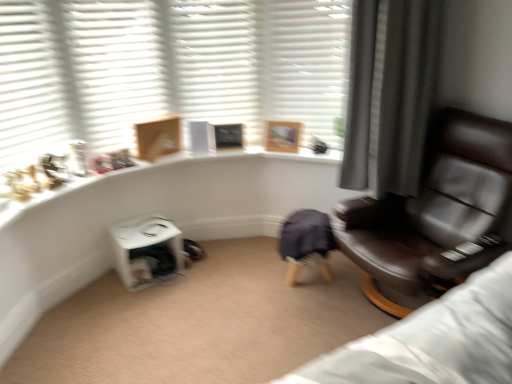
Describe the element at coordinates (29, 85) in the screenshot. This screenshot has width=512, height=384. I see `white matte shutters at upper left, positioned as the first shutter in left-to-right order` at that location.

Where is `white matte shutter at upper left, marked as the third shutter in a right-to-left arrangement`? This screenshot has width=512, height=384. white matte shutter at upper left, marked as the third shutter in a right-to-left arrangement is located at coordinates (114, 68).

Image resolution: width=512 pixels, height=384 pixels. I want to click on white matte shutters at upper left, the fourth shutter from the right, so click(29, 85).

Between white matte shutter at upper center, the second shutter from the right, and white matte shutter at upper left, the second shutter when ordered from left to right, which one has smaller width?

With smaller width is white matte shutter at upper center, the second shutter from the right.

Where is `shutter that is the 1st one when counting leftward from the white matte shutter at upper center, marked as the third shutter in a left-to-right arrangement`? Image resolution: width=512 pixels, height=384 pixels. shutter that is the 1st one when counting leftward from the white matte shutter at upper center, marked as the third shutter in a left-to-right arrangement is located at coordinates (114, 68).

Is white matte shutter at upper center, the second shutter from the right, turned away from white matte shutter at upper left, the second shutter when ordered from left to right?

No, white matte shutter at upper center, the second shutter from the right,'s orientation is not away from white matte shutter at upper left, the second shutter when ordered from left to right.

Would you say white matte shutter at upper center, the second shutter from the right, is outside white matte shutter at upper left, the second shutter when ordered from left to right?

Absolutely, white matte shutter at upper center, the second shutter from the right, is external to white matte shutter at upper left, the second shutter when ordered from left to right.

Would you consider white matte shutters at upper left, the fourth shutter from the right, to be distant from brown leather chair at right?

Yes, white matte shutters at upper left, the fourth shutter from the right, is far from brown leather chair at right.

Can you confirm if white matte shutters at upper left, positioned as the first shutter in left-to-right order, is positioned to the right of brown leather chair at right?

Incorrect, white matte shutters at upper left, positioned as the first shutter in left-to-right order, is not on the right side of brown leather chair at right.

How different are the orientations of white matte shutters at upper left, the fourth shutter from the right, and brown leather chair at right in degrees?

They differ by 119 degrees in their facing directions.

Between white matte shutters at upper left, the fourth shutter from the right, and brown leather chair at right, which one has smaller size?

white matte shutters at upper left, the fourth shutter from the right, is smaller.

Is brown leather chair at right aimed at white matte shutter at upper left, the second shutter when ordered from left to right?

No, brown leather chair at right is not facing towards white matte shutter at upper left, the second shutter when ordered from left to right.

Which object is closer to the camera taking this photo, brown leather chair at right or white matte shutter at upper left, marked as the third shutter in a right-to-left arrangement?

brown leather chair at right is closer to the camera.

Is brown leather chair at right far from white matte shutter at upper left, the second shutter when ordered from left to right?

brown leather chair at right is far away from white matte shutter at upper left, the second shutter when ordered from left to right.

Does brown leather chair at right have a greater height compared to white matte shutter at upper left, the second shutter when ordered from left to right?

Indeed, brown leather chair at right has a greater height compared to white matte shutter at upper left, the second shutter when ordered from left to right.

From the picture: Would you consider white matte shutter at upper center, arranged as the first shutter when viewed from the right, to be distant from white plastic table at lower center?

Yes, white matte shutter at upper center, arranged as the first shutter when viewed from the right, and white plastic table at lower center are quite far apart.

Is white matte shutter at upper center, arranged as the first shutter when viewed from the right, behind white plastic table at lower center?

No, white matte shutter at upper center, arranged as the first shutter when viewed from the right, is closer to the viewer.

What's the angular difference between white matte shutter at upper center, arranged as the first shutter when viewed from the right, and white plastic table at lower center's facing directions?

54.7 degrees.

Is white matte shutter at upper center, arranged as the first shutter when viewed from the right, to the left or to the right of white plastic table at lower center in the image?

Based on their positions, white matte shutter at upper center, arranged as the first shutter when viewed from the right, is located to the right of white plastic table at lower center.

Is white plastic table at lower center outside of wooden picture frame at upper center?

Yes, white plastic table at lower center is outside of wooden picture frame at upper center.

At what (x,y) coordinates should I click in order to perform the action: click on picture frame to the right of white plastic table at lower center. Please return your answer as a coordinate pair (x, y). The image size is (512, 384). Looking at the image, I should click on (282, 136).

Does white plastic table at lower center appear on the right side of wooden picture frame at upper center?

No, white plastic table at lower center is not to the right of wooden picture frame at upper center.

Is white plastic table at lower center oriented away from wooden picture frame at upper center?

No.

Consider the image. Does white matte shutter at upper center, arranged as the first shutter when viewed from the right, appear on the left side of white matte shutter at upper center, the second shutter from the right?

No, white matte shutter at upper center, arranged as the first shutter when viewed from the right, is not to the left of white matte shutter at upper center, the second shutter from the right.

Is there a large distance between white matte shutter at upper center, arranged as the first shutter when viewed from the right, and white matte shutter at upper center, the second shutter from the right?

No.

From the image's perspective, is white matte shutter at upper center, which appears as the 4th shutter when viewed from the left, above or below white matte shutter at upper center, marked as the third shutter in a left-to-right arrangement?

white matte shutter at upper center, which appears as the 4th shutter when viewed from the left, is situated lower than white matte shutter at upper center, marked as the third shutter in a left-to-right arrangement, in the image.

In terms of size, does white matte shutter at upper center, arranged as the first shutter when viewed from the right, appear bigger or smaller than white matte shutter at upper center, the second shutter from the right?

white matte shutter at upper center, arranged as the first shutter when viewed from the right, is smaller than white matte shutter at upper center, the second shutter from the right.

Which of these two, wooden picture frame at upper center or white matte shutter at upper left, marked as the third shutter in a right-to-left arrangement, is thinner?

wooden picture frame at upper center.

Which object is positioned more to the right, wooden picture frame at upper center or white matte shutter at upper left, the second shutter when ordered from left to right?

wooden picture frame at upper center is more to the right.

From the image's perspective, would you say wooden picture frame at upper center is shown under white matte shutter at upper left, the second shutter when ordered from left to right?

Indeed, from the image's perspective, wooden picture frame at upper center is shown beneath white matte shutter at upper left, the second shutter when ordered from left to right.

Can you confirm if wooden picture frame at upper center is taller than white matte shutter at upper left, marked as the third shutter in a right-to-left arrangement?

No.

Locate an element on the screen. the 2nd shutter below the white matte shutter at upper center, the second shutter from the right (from the image's perspective) is located at coordinates (114, 68).

Identify the location of the 4th shutter positioned above the brown leather chair at right (from a real-world perspective). Image resolution: width=512 pixels, height=384 pixels. (29, 85).

From the image, which object appears to be nearer to white matte shutter at upper left, the second shutter when ordered from left to right, white matte shutters at upper left, positioned as the first shutter in left-to-right order, or wooden picture frame at upper center?

white matte shutters at upper left, positioned as the first shutter in left-to-right order.

Which object lies further to the anchor point white matte shutter at upper center, which appears as the 4th shutter when viewed from the left, white plastic table at lower center or white matte shutter at upper center, the second shutter from the right?

The object further to white matte shutter at upper center, which appears as the 4th shutter when viewed from the left, is white plastic table at lower center.

Based on their spatial positions, is wooden picture frame at upper center or white matte shutter at upper left, marked as the third shutter in a right-to-left arrangement, further from brown leather chair at right?

The object further to brown leather chair at right is white matte shutter at upper left, marked as the third shutter in a right-to-left arrangement.

Based on their spatial positions, is white plastic table at lower center or white matte shutter at upper center, which appears as the 4th shutter when viewed from the left, closer to white matte shutter at upper left, marked as the third shutter in a right-to-left arrangement?

Among the two, white plastic table at lower center is located nearer to white matte shutter at upper left, marked as the third shutter in a right-to-left arrangement.

Which object lies nearer to the anchor point white matte shutter at upper center, the second shutter from the right, wooden picture frame at upper center or white plastic table at lower center?

wooden picture frame at upper center is closer to white matte shutter at upper center, the second shutter from the right.

When comparing their distances from brown leather chair at right, does white matte shutter at upper left, the second shutter when ordered from left to right, or white plastic table at lower center seem closer?

white plastic table at lower center is positioned closer to the anchor brown leather chair at right.

Estimate the real-world distances between objects in this image. Which object is closer to white matte shutter at upper left, the second shutter when ordered from left to right, brown leather chair at right or white plastic table at lower center?

The object closer to white matte shutter at upper left, the second shutter when ordered from left to right, is white plastic table at lower center.

From the image, which object appears to be nearer to brown leather chair at right, white plastic table at lower center or white matte shutters at upper left, positioned as the first shutter in left-to-right order?

Based on the image, white plastic table at lower center appears to be nearer to brown leather chair at right.

Find the location of a particular element. table located between white matte shutter at upper left, marked as the third shutter in a right-to-left arrangement, and white matte shutter at upper center, which appears as the 4th shutter when viewed from the left, in the left-right direction is located at coordinates (147, 250).

Where is `picture frame situated between white matte shutter at upper left, the second shutter when ordered from left to right, and brown leather chair at right from left to right`? The height and width of the screenshot is (384, 512). picture frame situated between white matte shutter at upper left, the second shutter when ordered from left to right, and brown leather chair at right from left to right is located at coordinates tap(282, 136).

The width and height of the screenshot is (512, 384). Identify the location of picture frame situated between white matte shutter at upper center, the second shutter from the right, and white matte shutter at upper center, which appears as the 4th shutter when viewed from the left, from left to right. (282, 136).

Where is `picture frame situated between white matte shutter at upper left, the second shutter when ordered from left to right, and white matte shutter at upper center, which appears as the 4th shutter when viewed from the left, from left to right`? The image size is (512, 384). picture frame situated between white matte shutter at upper left, the second shutter when ordered from left to right, and white matte shutter at upper center, which appears as the 4th shutter when viewed from the left, from left to right is located at coordinates (282, 136).